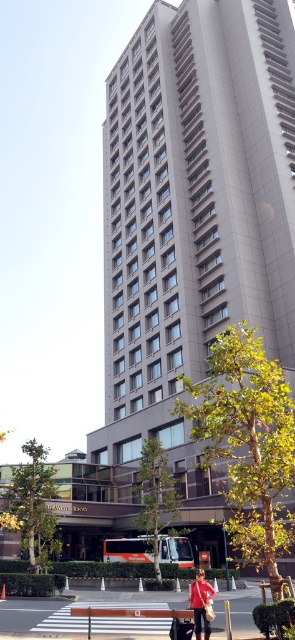
You are a city planner assessing the urban space in front of the gray concrete building at center. The smooth asphalt pavement at lower center is part of the pedestrian area. Considering the height of the building, would it cast a shadow over the pavement during midday in winter?

The gray concrete building at center is much taller than the smooth asphalt pavement at lower center. Since the building is significantly taller, its shadow during midday in winter would likely extend over the smooth asphalt pavement at lower center, depending on the sun angle and time of day.